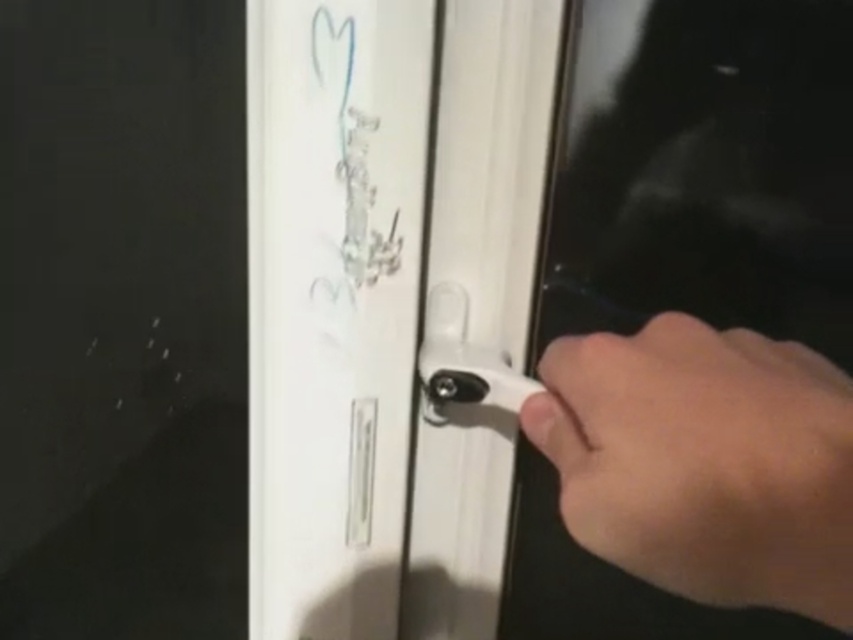
Question: Among these objects, which one is nearest to the camera?

Choices:
 (A) white glossy door handle at center
 (B) skinny white hand at right

Answer: (B)

Question: Which object appears farthest from the camera in this image?

Choices:
 (A) white plastic door handle at center
 (B) white glossy door handle at center

Answer: (B)

Question: Is white glossy door handle at center bigger than skinny white hand at right?

Choices:
 (A) no
 (B) yes

Answer: (B)

Question: Which object is farther from the camera taking this photo?

Choices:
 (A) white glossy door handle at center
 (B) skinny white hand at right
 (C) white plastic door handle at center

Answer: (A)

Question: Is skinny white hand at right positioned in front of white plastic door handle at center?

Choices:
 (A) no
 (B) yes

Answer: (B)

Question: Is white glossy door handle at center to the left of white plastic door handle at center from the viewer's perspective?

Choices:
 (A) yes
 (B) no

Answer: (A)